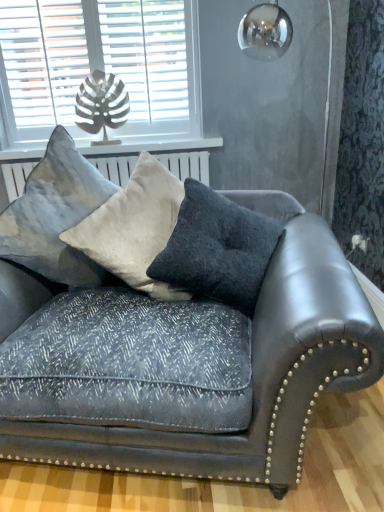
Question: Is white wooden blinds at upper left taller or shorter than white painted wood at upper left?

Choices:
 (A) short
 (B) tall

Answer: (B)

Question: From the image's perspective, relative to white painted wood at upper left, is white wooden blinds at upper left above or below?

Choices:
 (A) above
 (B) below

Answer: (A)

Question: Estimate the real-world distances between objects in this image. Which object is farther from the textured velvet pillow at center, the 2th pillow from the right?

Choices:
 (A) textured gray pillow at upper left, which ranks as the 3th pillow in right-to-left order
 (B) velvet dark gray couch at center
 (C) white wooden blinds at upper left
 (D) dark gray textured pillow at center, the first pillow viewed from the right
 (E) white painted wood at upper left

Answer: (C)

Question: Which of these objects is positioned farthest from the white wooden blinds at upper left?

Choices:
 (A) white painted wood at upper left
 (B) dark gray textured pillow at center, the first pillow viewed from the right
 (C) textured gray pillow at upper left, arranged as the first pillow when viewed from the left
 (D) velvet dark gray couch at center
 (E) textured velvet pillow at center, the 2th pillow viewed from the left

Answer: (D)